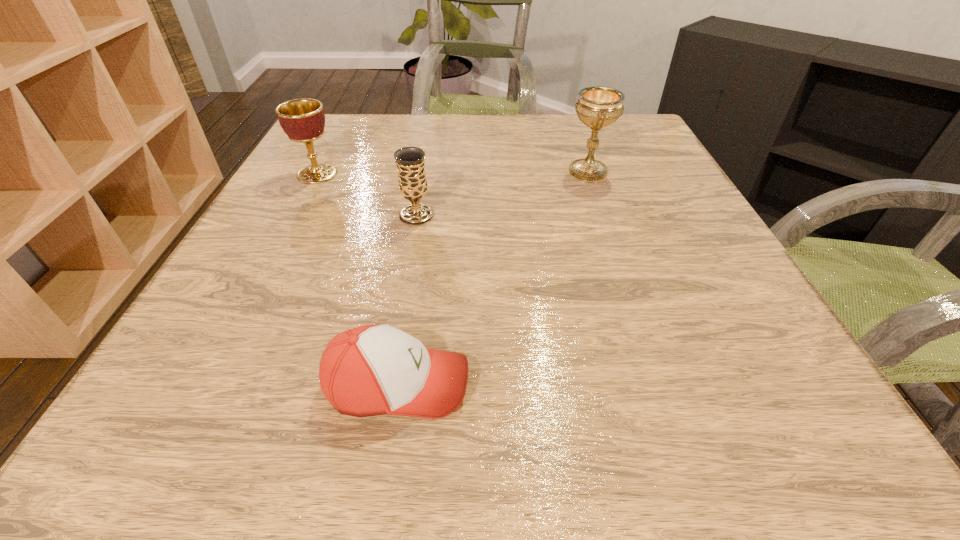
Where is `object located in the near edge section of the desktop`? Image resolution: width=960 pixels, height=540 pixels. object located in the near edge section of the desktop is located at coordinates (370, 370).

Image resolution: width=960 pixels, height=540 pixels. Find the location of `object that is at the left edge`. object that is at the left edge is located at coordinates (303, 120).

Identify the location of object situated at the right edge. (597, 107).

In the image, there is a desktop. In order to click on vacant space at the far edge in this screenshot , I will do `click(416, 132)`.

In the image, there is a desktop. In order to click on vacant space at the near edge in this screenshot , I will do pos(630,394).

Where is `free space at the left edge of the desktop`? free space at the left edge of the desktop is located at coordinates (266, 230).

Identify the location of vacant area at the right edge of the desktop. Image resolution: width=960 pixels, height=540 pixels. (686, 247).

Where is `vacant space at the far left corner`? This screenshot has width=960, height=540. vacant space at the far left corner is located at coordinates (358, 143).

Image resolution: width=960 pixels, height=540 pixels. I want to click on blank area at the near left corner, so 135,405.

Locate an element on the screen. empty space that is in between the rightmost object and the shortest object is located at coordinates (492, 278).